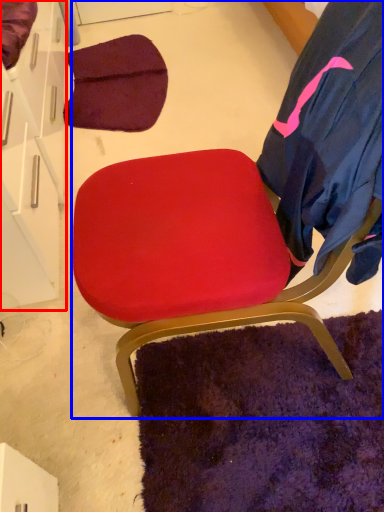
Question: Which object appears farthest to the camera in this image, drawer (highlighted by a red box) or chair (highlighted by a blue box)?

Choices:
 (A) drawer
 (B) chair

Answer: (A)